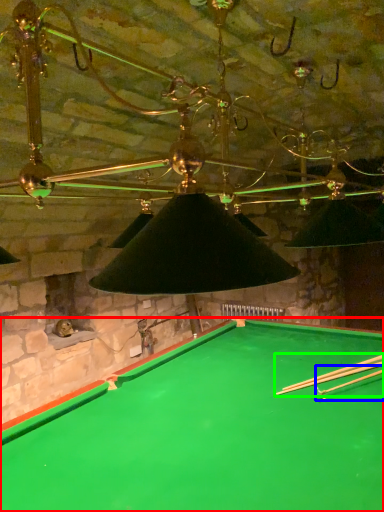
Question: Based on their relative distances, which object is nearer to billiard table (highlighted by a red box)? Choose from cue (highlighted by a blue box) and cue (highlighted by a green box).

Choices:
 (A) cue
 (B) cue

Answer: (B)